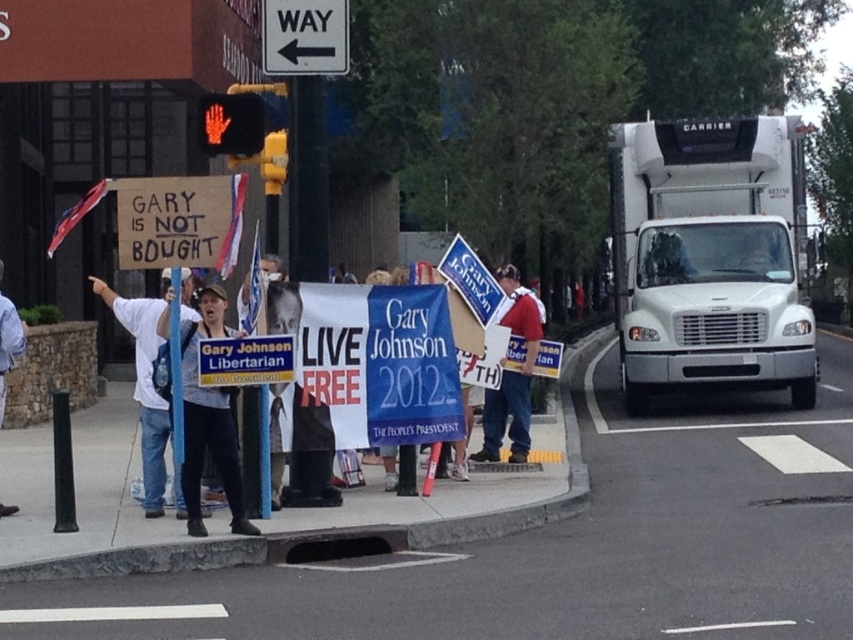
Question: Can you confirm if white cotton shirt at center is positioned below red fabric sign at center?

Choices:
 (A) yes
 (B) no

Answer: (B)

Question: Considering the relative positions of white metallic truck at right and cardboard sign at center in the image provided, where is white metallic truck at right located with respect to cardboard sign at center?

Choices:
 (A) right
 (B) left

Answer: (A)

Question: Which point is closer to the camera?

Choices:
 (A) red led hand at upper left
 (B) cardboard sign at center
 (C) white cotton shirt at center

Answer: (B)

Question: Estimate the real-world distances between objects in this image. Which object is closer to the white metallic truck at right?

Choices:
 (A) red fabric sign at center
 (B) white plastic sign at upper center
 (C) white cotton shirt at center
 (D) denim jacket at lower left

Answer: (A)

Question: Can you confirm if white metallic truck at right is positioned above cardboard sign at center?

Choices:
 (A) no
 (B) yes

Answer: (A)

Question: Which point is closer to the camera taking this photo?

Choices:
 (A) (19, 336)
 (B) (122, 211)
 (C) (538, 304)
 (D) (282, 52)

Answer: (B)